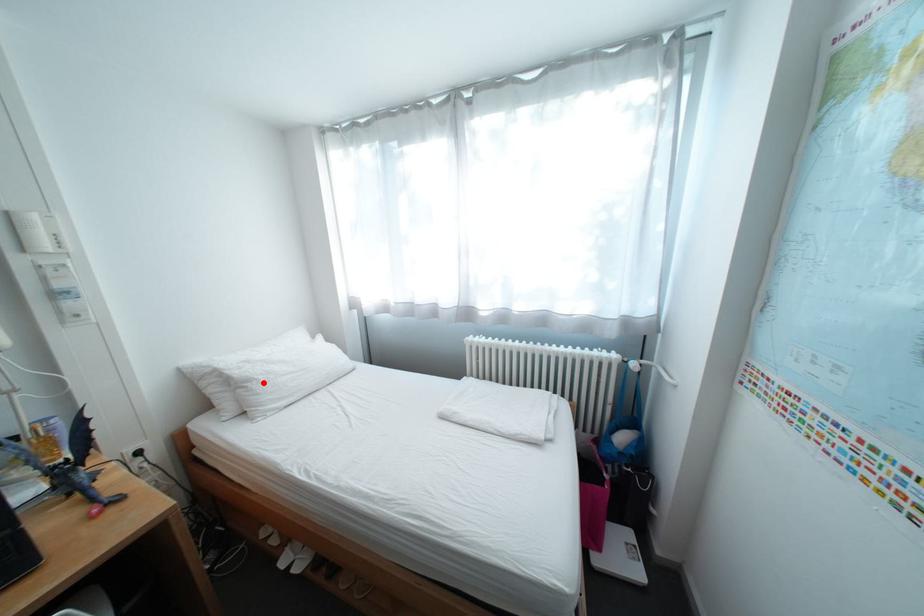
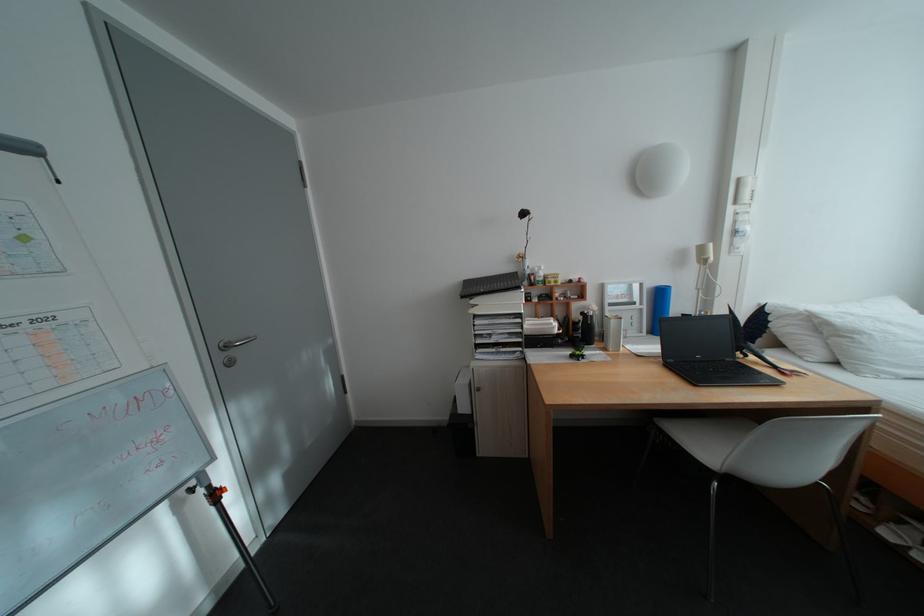
In the second image, find the point that corresponds to the highlighted location in the first image.

(871, 334)